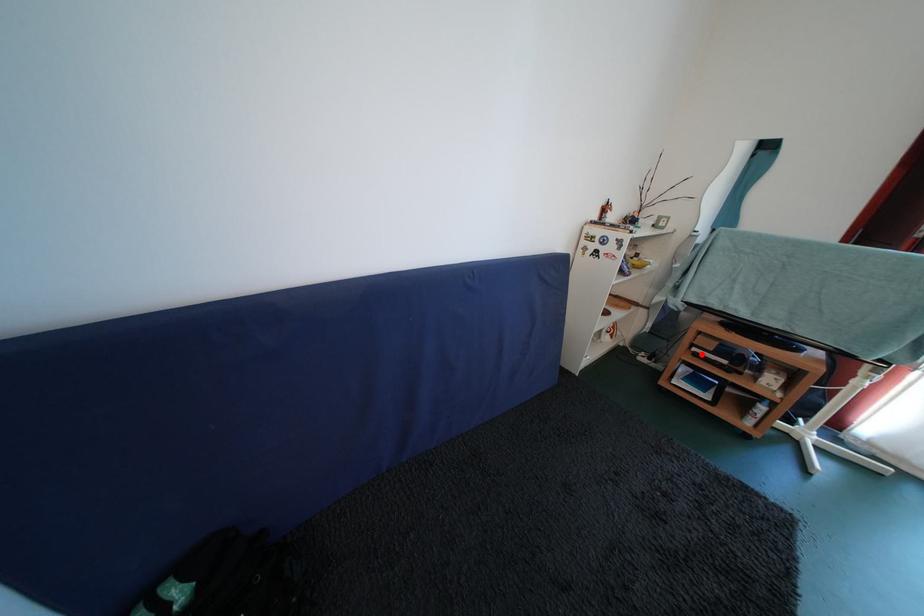
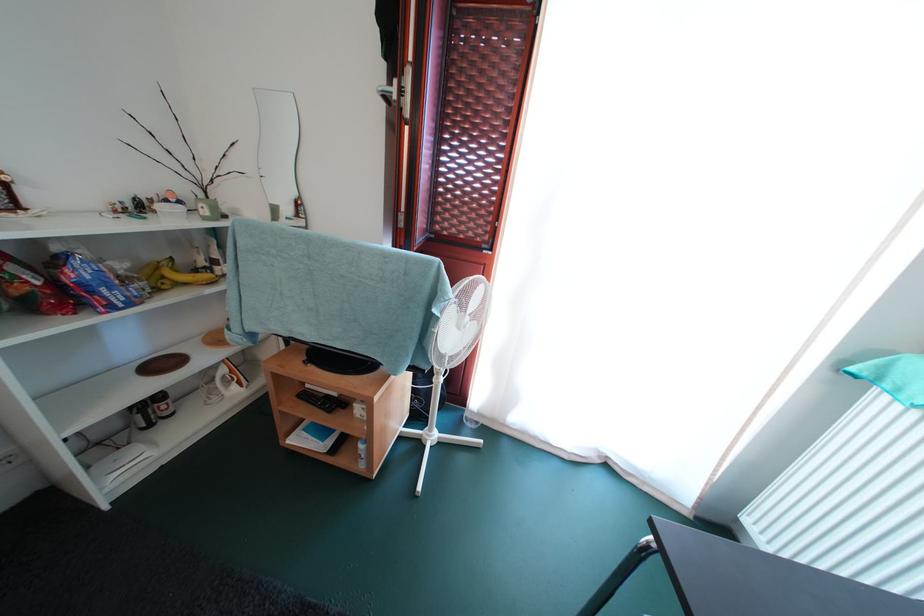
Where in the second image is the point corresponding to the highlighted location from the first image?

(314, 391)